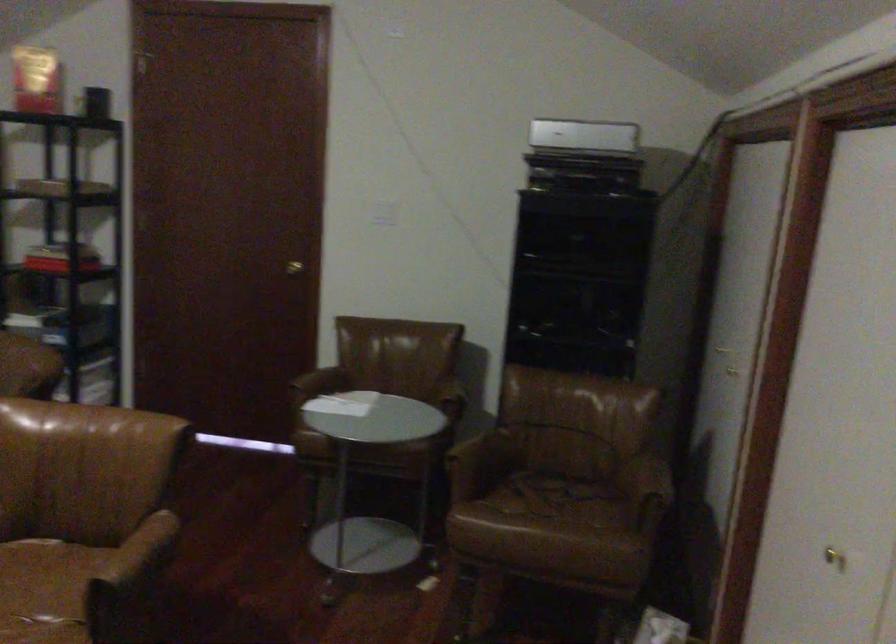
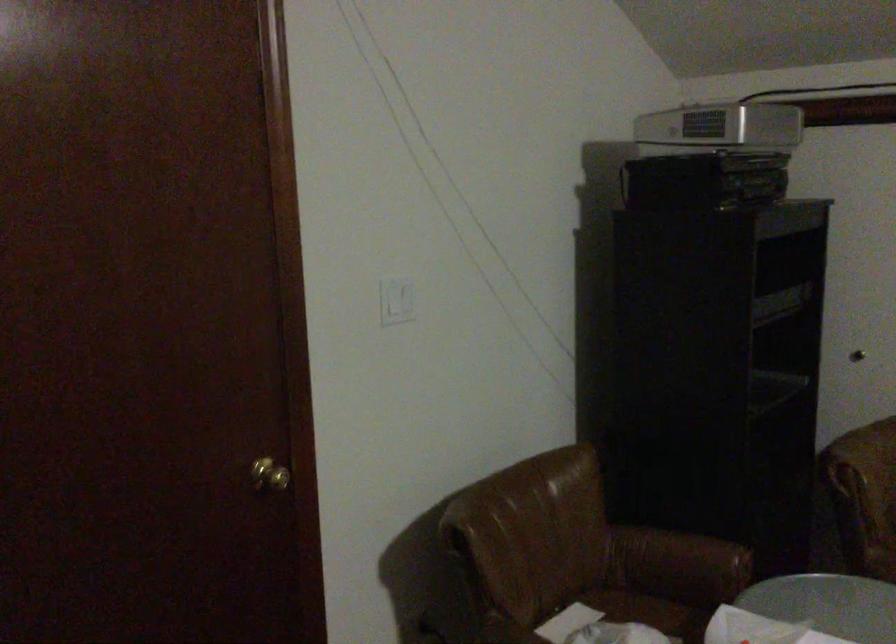
Locate, in the second image, the point that corresponds to the point at 545,131 in the first image.

(719, 129)